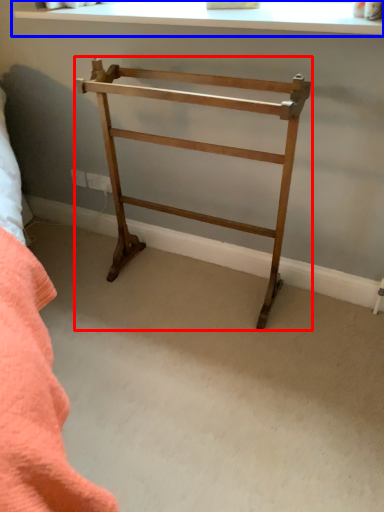
Question: Which point is closer to the camera, furniture (highlighted by a red box) or window (highlighted by a blue box)?

Choices:
 (A) furniture
 (B) window

Answer: (A)